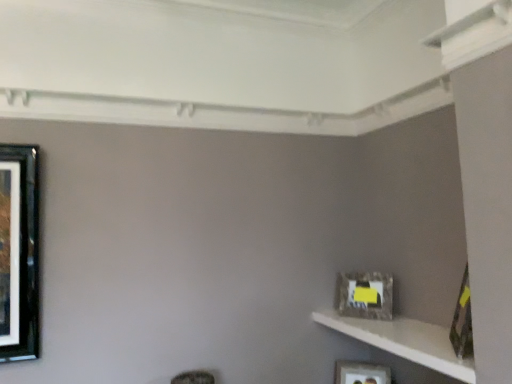
Question: Is white textured shelf at lower right inside matte black picture frame at lower right, the 1th picture frame in the bottom-to-top sequence?

Choices:
 (A) no
 (B) yes

Answer: (A)

Question: From a real-world perspective, is matte black picture frame at lower right, which is the third picture frame from front to back, located higher than white textured shelf at lower right?

Choices:
 (A) yes
 (B) no

Answer: (B)

Question: From the image's perspective, would you say matte black picture frame at lower right, acting as the third picture frame starting from the top, is positioned over white textured shelf at lower right?

Choices:
 (A) yes
 (B) no

Answer: (B)

Question: Is matte black picture frame at lower right, the 1th picture frame in the bottom-to-top sequence, taller than white textured shelf at lower right?

Choices:
 (A) no
 (B) yes

Answer: (B)

Question: Is matte black picture frame at lower right, which is the third picture frame from front to back, facing away from white textured shelf at lower right?

Choices:
 (A) no
 (B) yes

Answer: (A)

Question: Is matte black picture frame at lower right, the 1th picture frame in the back-to-front sequence, not inside white textured shelf at lower right?

Choices:
 (A) no
 (B) yes

Answer: (B)

Question: From a real-world perspective, is matte gray frame at right, which is the 2th picture frame from back to front, located higher than white textured shelf at lower right?

Choices:
 (A) no
 (B) yes

Answer: (B)

Question: Is the surface of matte gray frame at right, which is the second picture frame in top-to-bottom order, in direct contact with white textured shelf at lower right?

Choices:
 (A) yes
 (B) no

Answer: (B)

Question: Considering the relative sizes of matte gray frame at right, which is the 2th picture frame from back to front, and white textured shelf at lower right in the image provided, is matte gray frame at right, which is the 2th picture frame from back to front, smaller than white textured shelf at lower right?

Choices:
 (A) yes
 (B) no

Answer: (A)

Question: Is matte gray frame at right, which is the second picture frame in top-to-bottom order, aimed at white textured shelf at lower right?

Choices:
 (A) no
 (B) yes

Answer: (A)

Question: Would you say white textured shelf at lower right is part of matte gray frame at right, placed as the 2th picture frame when sorted from front to back,'s contents?

Choices:
 (A) yes
 (B) no

Answer: (B)

Question: From the image's perspective, is matte gray frame at right, which is the 2th picture frame from back to front, located above white textured shelf at lower right?

Choices:
 (A) yes
 (B) no

Answer: (A)

Question: Is white textured shelf at lower right thinner than camouflage-patterned frame at right, which is counted as the first picture frame, starting from the top?

Choices:
 (A) no
 (B) yes

Answer: (A)